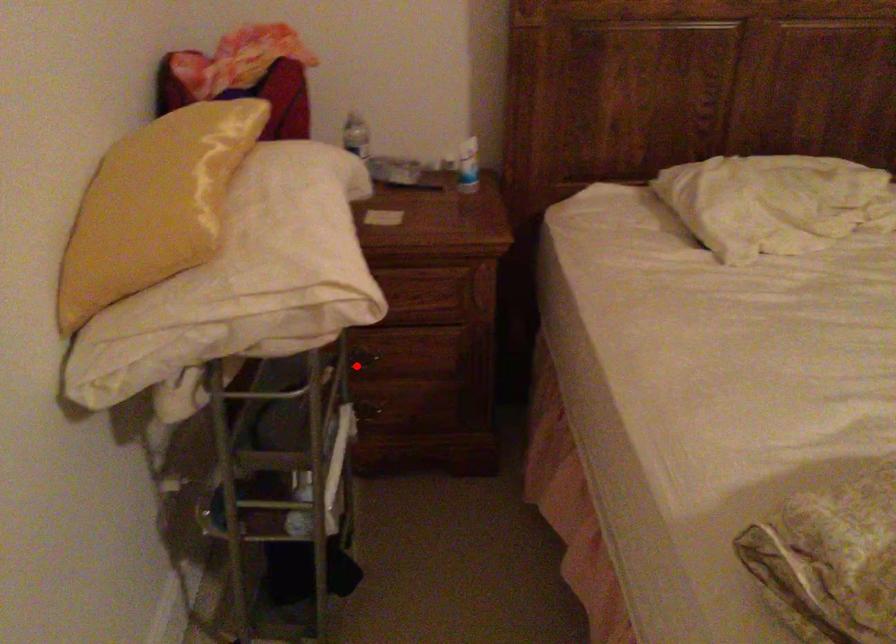
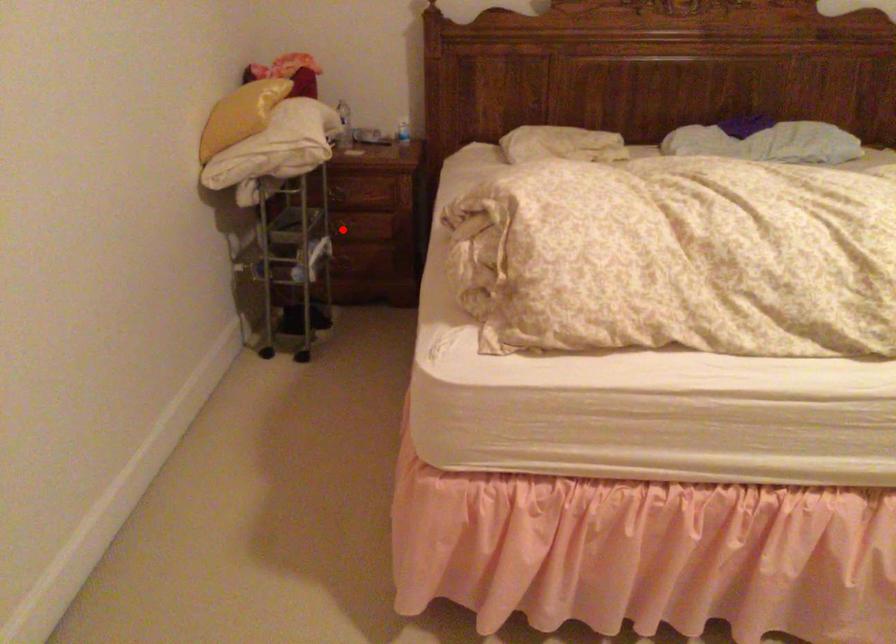
I am providing you with two images of the same scene from different viewpoints. A red point is marked on the first image and another point is marked on the second image. Are the points marked in image1 and image2 representing the same 3D position?

Yes